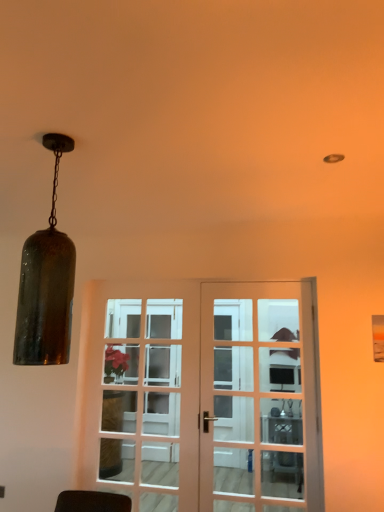
Question: Looking at their shapes, would you say white glass screen door at center is wider or thinner than matte white door at center, marked as the second door in a left-to-right arrangement?

Choices:
 (A) thin
 (B) wide

Answer: (B)

Question: In terms of height, does white glass screen door at center look taller or shorter compared to matte white door at center, which appears as the 1th door when viewed from the right?

Choices:
 (A) short
 (B) tall

Answer: (B)

Question: Estimate the real-world distances between objects in this image. Which object is closer to the amber glass pendant light at left?

Choices:
 (A) metallic silver table at center
 (B) matte white door at center, which appears as the 1th door when viewed from the right
 (C) wooden glass door at center, which is the second door from right to left
 (D) white glass screen door at center

Answer: (D)

Question: Which of these objects is positioned farthest from the metallic silver table at center?

Choices:
 (A) wooden glass door at center, which is the second door from right to left
 (B) amber glass pendant light at left
 (C) white glass screen door at center
 (D) matte white door at center, which appears as the 1th door when viewed from the right

Answer: (B)